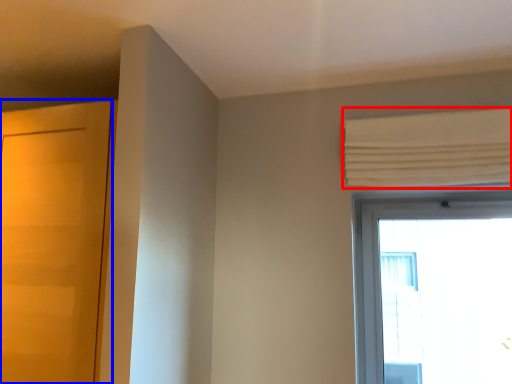
Question: Which object is closer to the camera taking this photo, curtain (highlighted by a red box) or door (highlighted by a blue box)?

Choices:
 (A) curtain
 (B) door

Answer: (B)